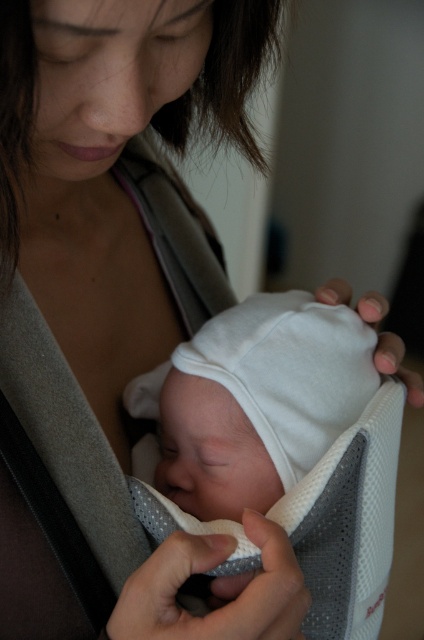
Measure the distance between white soft hat at center and camera.

A distance of 17.47 inches exists between white soft hat at center and camera.

Does white soft hat at center come in front of gray fabric strap at center?

Yes.

Measure the distance between point (295, 481) and camera.

They are 21.54 inches apart.

Locate an element on the screen. white soft hat at center is located at coordinates (251, 403).